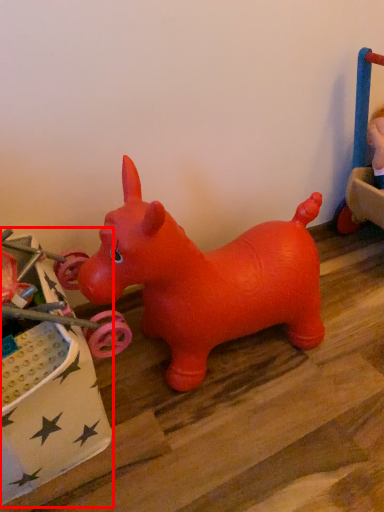
Question: In this image, where is toy (annotated by the red box) located relative to toy?

Choices:
 (A) left
 (B) right

Answer: (A)